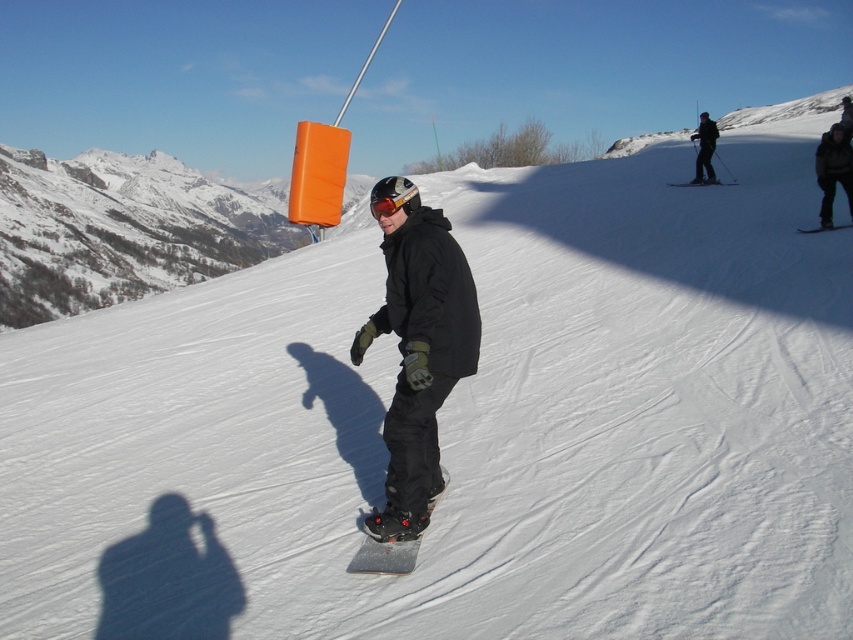
You are a photographer trying to capture both the black matte snowboard at center and the matte black snowboard at upper center in a single shot. Which snowboard appears larger in the photo?

The matte black snowboard at upper center appears larger in the photo because it is closer to the photographer than the black matte snowboard at center, which is smaller in size.

You are a photographer trying to capture the snowboarder. You notice the red reflective goggles at center and the matte black snowboard at upper center. Which object should you focus on to avoid overexposure due to brightness?

The red reflective goggles at center should be focused on because it is taller than the matte black snowboard at upper center, making it more likely to cause overexposure due to its reflective surface and prominence in the frame.